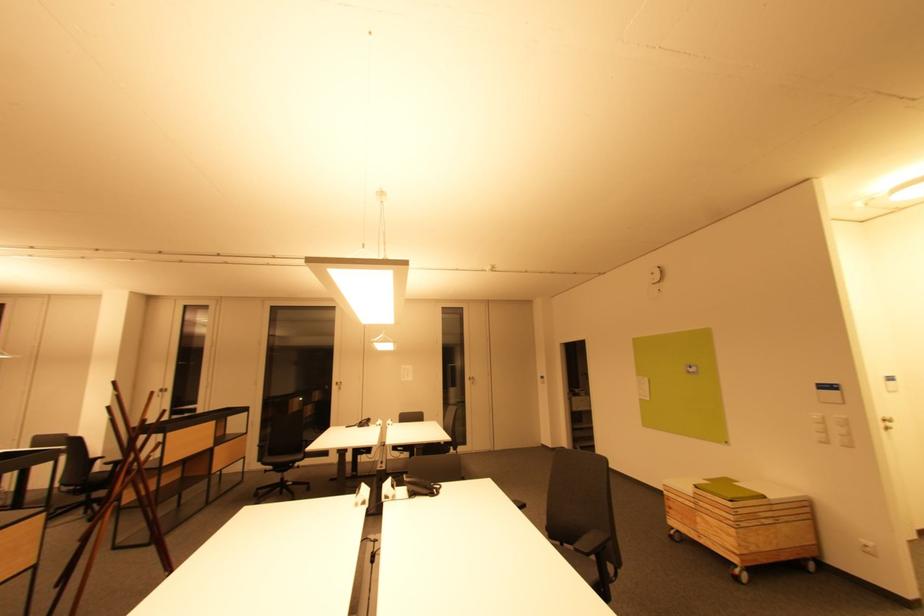
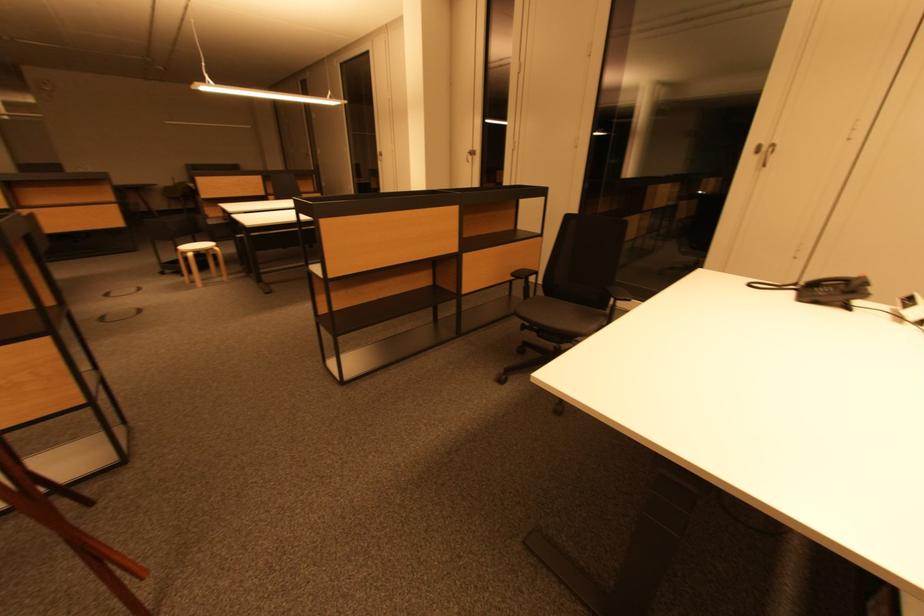
Find the pixel in the second image that matches the point at 365,424 in the first image.

(819, 286)